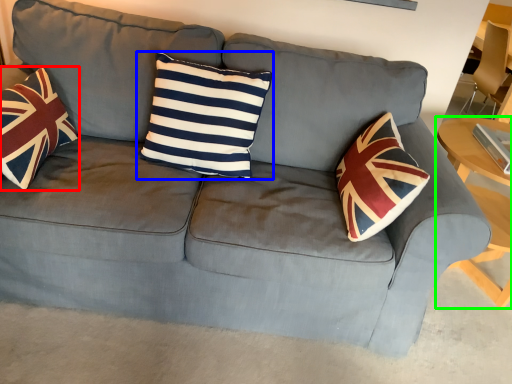
Question: Which object is positioned farthest from throw pillow (highlighted by a red box)? Select from pillow (highlighted by a blue box) and table (highlighted by a green box).

Choices:
 (A) pillow
 (B) table

Answer: (B)